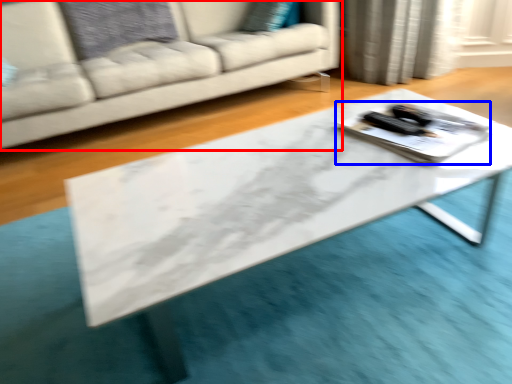
Question: Among these objects, which one is farthest to the camera, studio couch (highlighted by a red box) or tray (highlighted by a blue box)?

Choices:
 (A) studio couch
 (B) tray

Answer: (A)